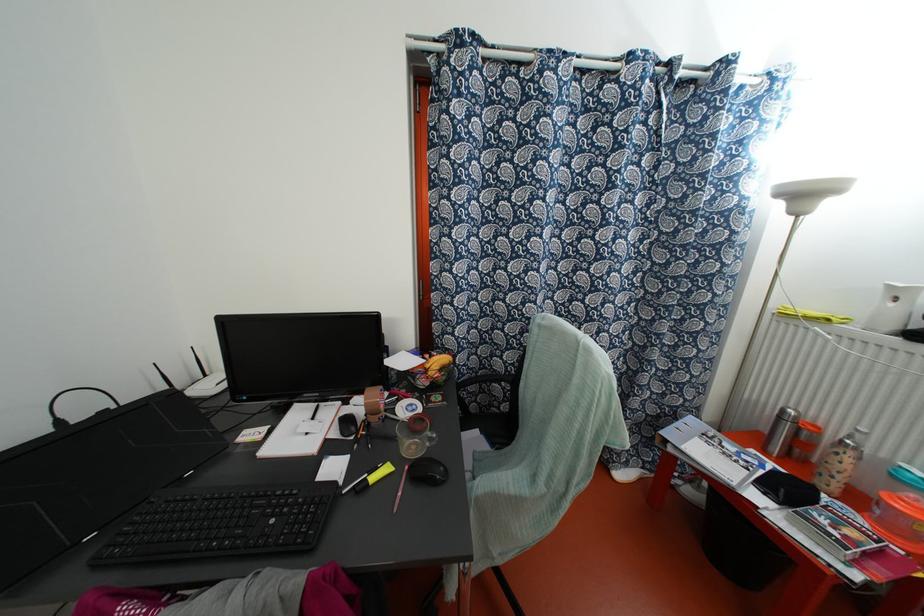
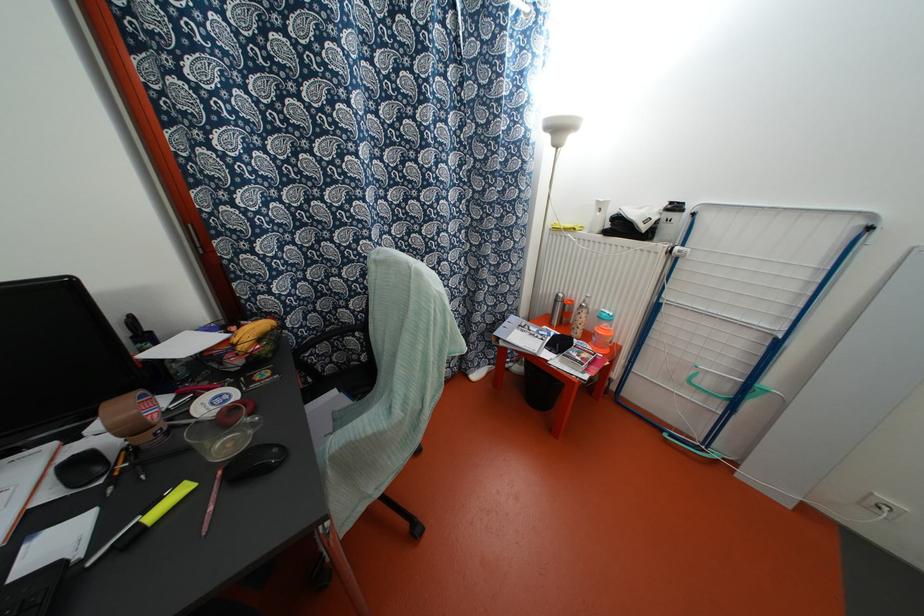
Locate, in the second image, the point that corresponds to (x=503, y=427) in the first image.

(362, 377)